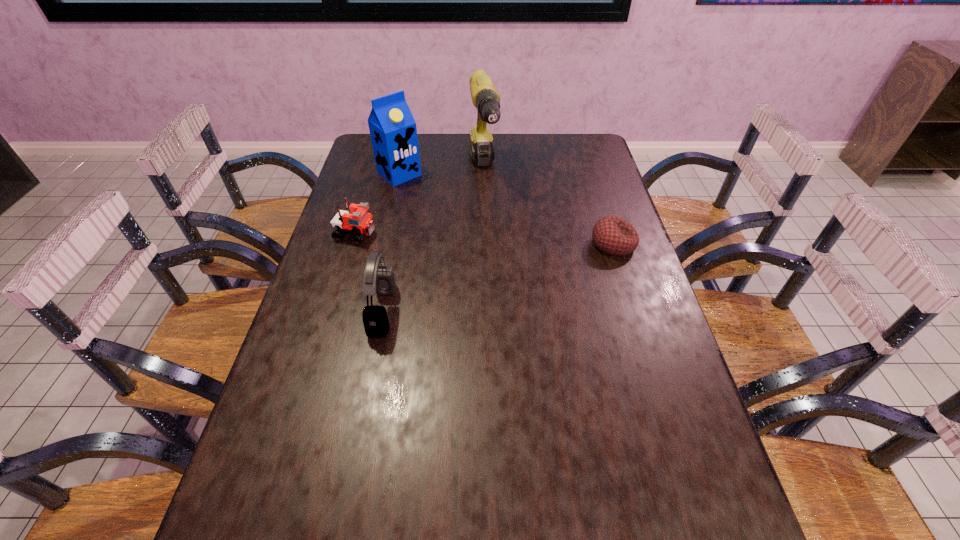
I want to click on free location that satisfies the following two spatial constraints: 1. on the front side of the beanbag; 2. on the left side of the fourth tallest object, so click(352, 244).

Locate an element on the screen. The height and width of the screenshot is (540, 960). blank area in the image that satisfies the following two spatial constraints: 1. on the front side of the Lego; 2. on the right side of the beanbag is located at coordinates (352, 244).